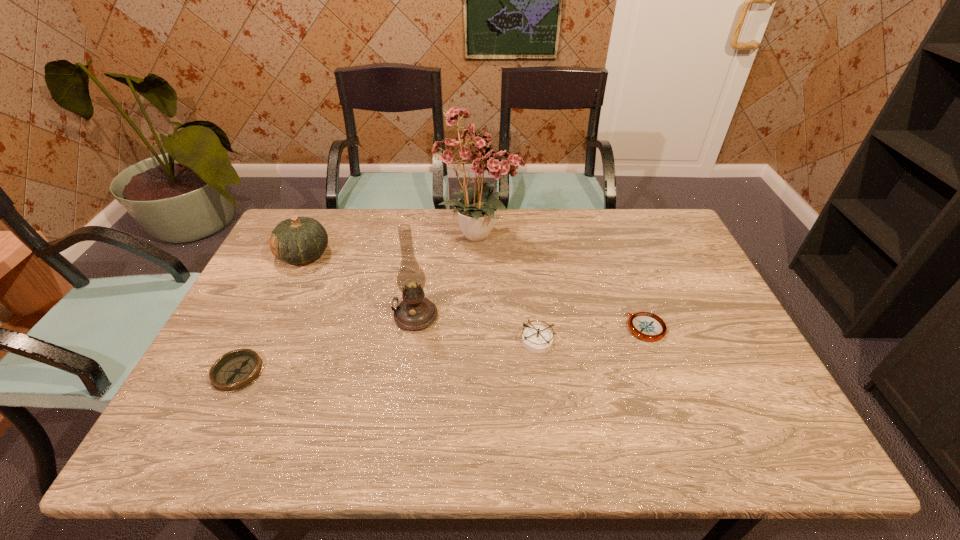
The width and height of the screenshot is (960, 540). I want to click on free location located on the back of the tallest compass, so click(532, 292).

You are a GUI agent. You are given a task and a screenshot of the screen. Output one action in this format:
    pyautogui.click(x=<x>, y=<y>)
    Task: Click on the free location located 0.250m on the back of the rightmost object
    
    Given the screenshot: What is the action you would take?
    pyautogui.click(x=619, y=255)

The width and height of the screenshot is (960, 540). Identify the location of vacant space situated on the back of the leftmost compass. (295, 256).

The height and width of the screenshot is (540, 960). In order to click on flower arrangement that is at the far edge in this screenshot , I will do `click(475, 155)`.

You are a GUI agent. You are given a task and a screenshot of the screen. Output one action in this format:
    pyautogui.click(x=<x>, y=<y>)
    Task: Click on the gourd located in the far edge section of the desktop
    
    Given the screenshot: What is the action you would take?
    pyautogui.click(x=298, y=240)

This screenshot has height=540, width=960. Identify the location of gourd at the left edge. (298, 240).

The width and height of the screenshot is (960, 540). What are the coordinates of `compass located in the left edge section of the desktop` in the screenshot? It's located at (235, 370).

This screenshot has height=540, width=960. Identify the location of object at the far left corner. (298, 240).

Where is `free space at the far edge`? free space at the far edge is located at coordinates (507, 234).

You are a GUI agent. You are given a task and a screenshot of the screen. Output one action in this format:
    pyautogui.click(x=<x>, y=<y>)
    Task: Click on the blank space at the near edge of the desktop
    The image size is (960, 540).
    Given the screenshot: What is the action you would take?
    pyautogui.click(x=462, y=428)